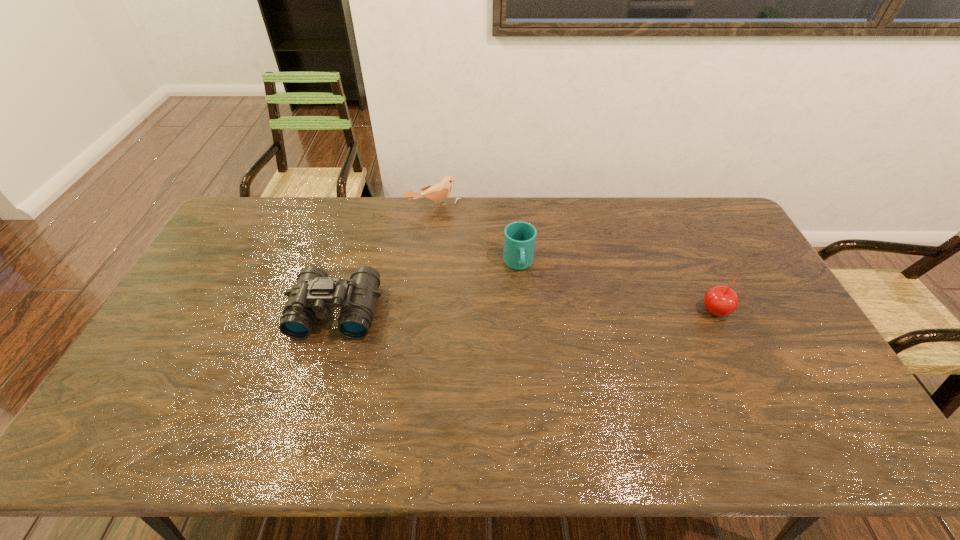
The image size is (960, 540). I want to click on binoculars, so click(x=314, y=294).

You are a GUI agent. You are given a task and a screenshot of the screen. Output one action in this format:
    pyautogui.click(x=<x>, y=<y>)
    Task: Click on the cherry
    The height and width of the screenshot is (540, 960).
    Given the screenshot: What is the action you would take?
    pyautogui.click(x=720, y=300)

The width and height of the screenshot is (960, 540). I want to click on cup, so click(519, 237).

In order to click on the second object from right to left in this screenshot , I will do 519,237.

Image resolution: width=960 pixels, height=540 pixels. Find the location of `the second object from left to right`. the second object from left to right is located at coordinates pos(437,193).

This screenshot has height=540, width=960. What are the coordinates of `the farthest object` in the screenshot? It's located at 437,193.

The image size is (960, 540). Identify the location of free space located 0.060m through the lenses of the leftmost object. (323, 359).

The image size is (960, 540). Identify the location of free region located on the back of the rightmost object. (699, 279).

Image resolution: width=960 pixels, height=540 pixels. I want to click on vacant position located on the handle side of the cup, so click(527, 313).

Image resolution: width=960 pixels, height=540 pixels. Identify the location of free location located on the handle side of the cup. (540, 380).